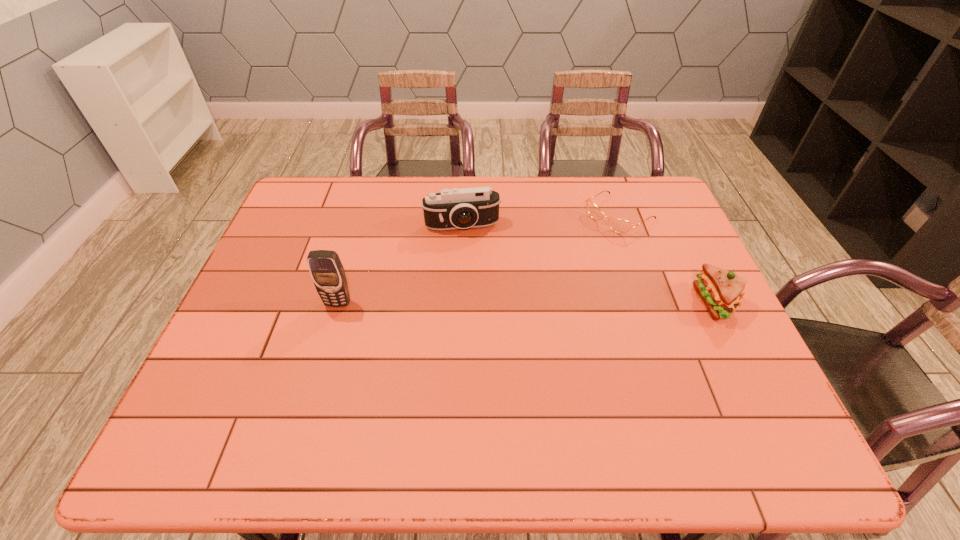
At what (x,y) coordinates should I click in order to perform the action: click on cellular telephone. Please return your answer as a coordinate pair (x, y). The image size is (960, 540). Looking at the image, I should click on (327, 272).

At what (x,y) coordinates should I click in order to perform the action: click on the leftmost object. Please return your answer as a coordinate pair (x, y). The height and width of the screenshot is (540, 960). Looking at the image, I should click on (327, 272).

You are a GUI agent. You are given a task and a screenshot of the screen. Output one action in this format:
    pyautogui.click(x=<x>, y=<y>)
    Task: Click on the sandwich
    
    Given the screenshot: What is the action you would take?
    pyautogui.click(x=721, y=290)

This screenshot has width=960, height=540. I want to click on the third object from left to right, so click(x=620, y=226).

Where is `spectacles`? The height and width of the screenshot is (540, 960). spectacles is located at coordinates (620, 226).

What are the coordinates of `the third object from right to left` in the screenshot? It's located at (454, 208).

Image resolution: width=960 pixels, height=540 pixels. I want to click on vacant space situated on the front face of the cellular telephone, so click(322, 357).

The image size is (960, 540). I want to click on vacant space located on the front of the rightmost object, so click(753, 380).

This screenshot has width=960, height=540. What are the coordinates of `free space located on the front-facing side of the spectacles` in the screenshot? It's located at (551, 262).

I want to click on vacant space located 0.100m on the front-facing side of the spectacles, so click(x=576, y=245).